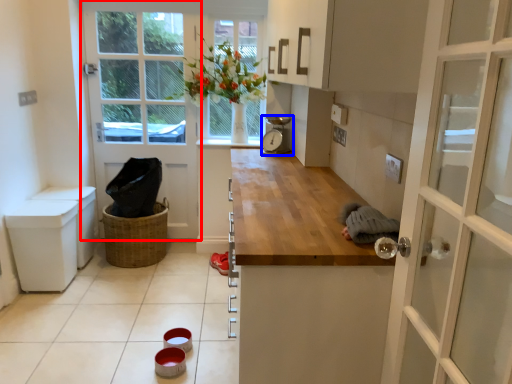
Question: Which object appears farthest to the camera in this image, door (highlighted by a red box) or appliance (highlighted by a blue box)?

Choices:
 (A) door
 (B) appliance

Answer: (A)